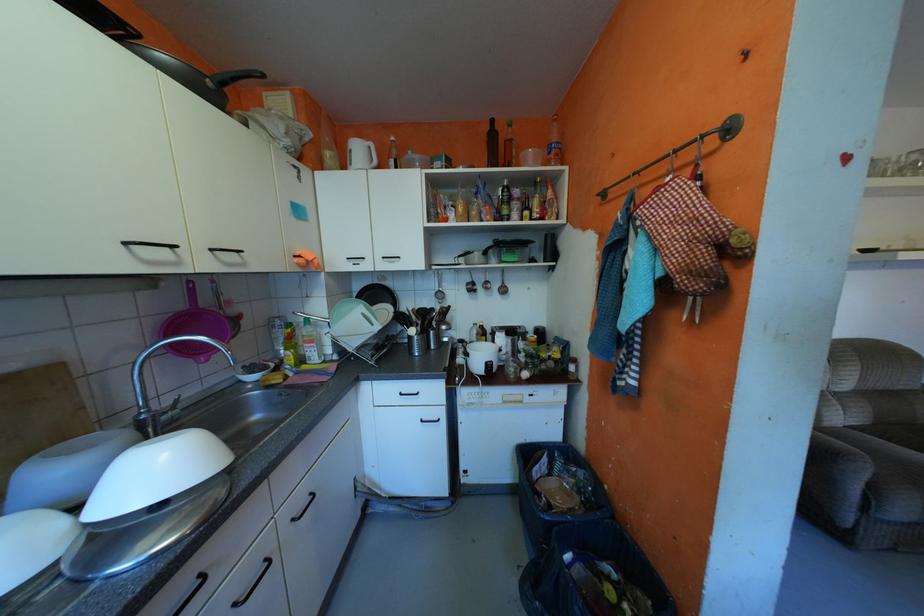
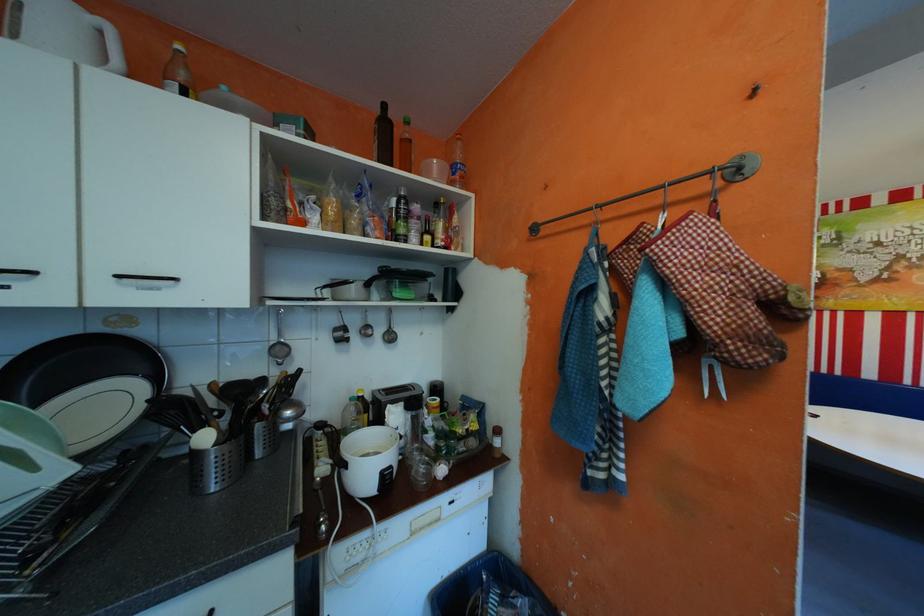
The point at (x=451, y=293) is marked in the first image. Where is the corresponding point in the second image?

(289, 346)